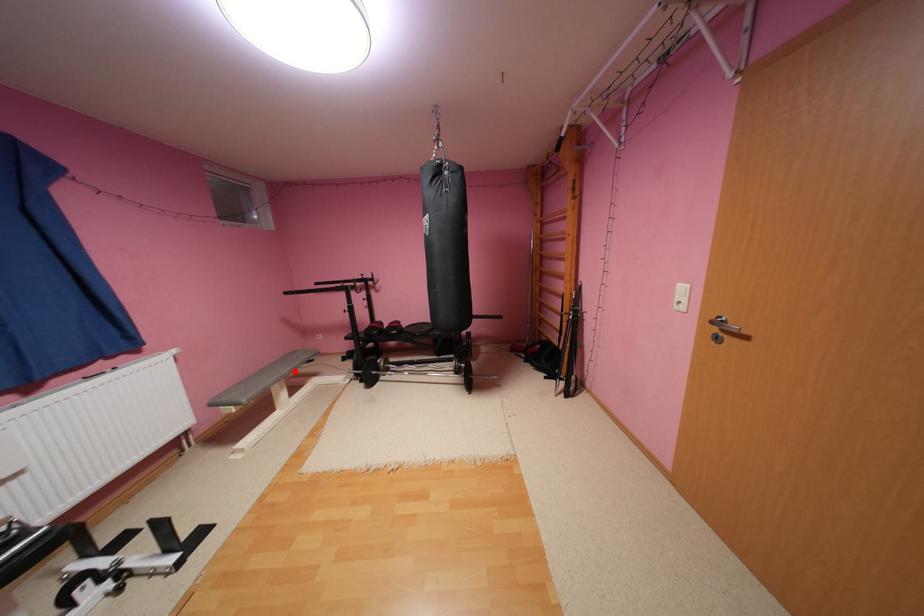
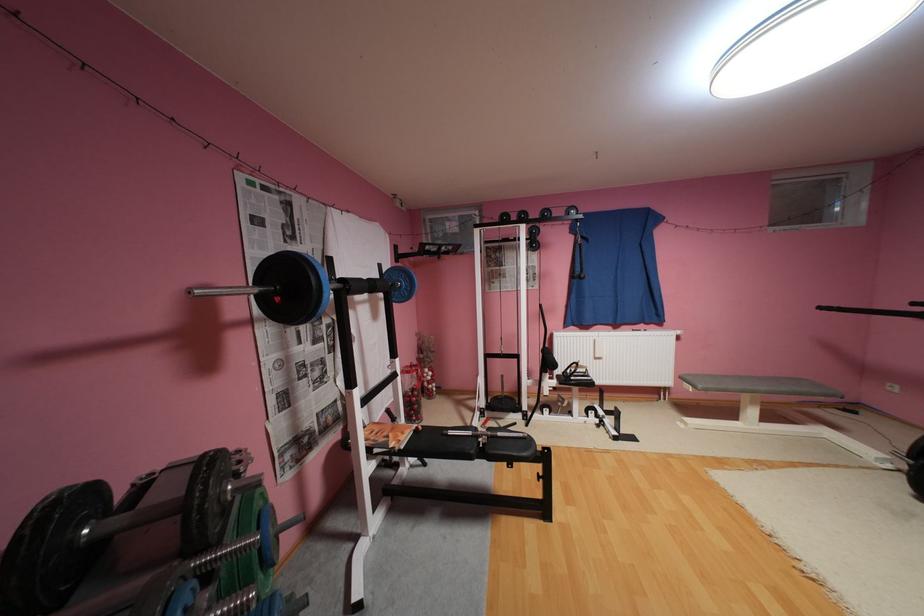
Question: I am providing you with two images of the same scene from different viewpoints. Image1 has a red point marked. In image2, the corresponding 3D location appears at what relative position? Reply with the corresponding letter.

Choices:
 (A) Closer
 (B) Farther

Answer: (B)